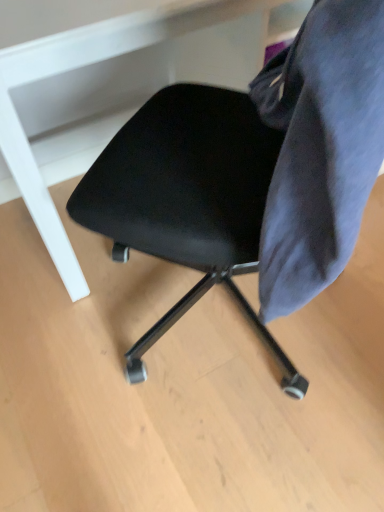
Question: Does black matte chair at center have a greater height compared to black leather chair at center?

Choices:
 (A) yes
 (B) no

Answer: (B)

Question: Is black matte chair at center outside of black leather chair at center?

Choices:
 (A) no
 (B) yes

Answer: (B)

Question: Is black matte chair at center surrounding black leather chair at center?

Choices:
 (A) no
 (B) yes

Answer: (A)

Question: Considering the relative sizes of black matte chair at center and black leather chair at center in the image provided, is black matte chair at center bigger than black leather chair at center?

Choices:
 (A) no
 (B) yes

Answer: (B)

Question: From the image's perspective, does black matte chair at center appear lower than black leather chair at center?

Choices:
 (A) no
 (B) yes

Answer: (A)

Question: Can you confirm if black matte chair at center is thinner than black leather chair at center?

Choices:
 (A) yes
 (B) no

Answer: (A)

Question: Does black matte chair at center have a greater height compared to velvet dark blue chair at right?

Choices:
 (A) yes
 (B) no

Answer: (A)

Question: From a real-world perspective, is black matte chair at center on top of velvet dark blue chair at right?

Choices:
 (A) no
 (B) yes

Answer: (A)

Question: Are black matte chair at center and velvet dark blue chair at right far apart?

Choices:
 (A) yes
 (B) no

Answer: (B)

Question: Does black matte chair at center have a greater width compared to velvet dark blue chair at right?

Choices:
 (A) no
 (B) yes

Answer: (B)

Question: Can you confirm if black matte chair at center is positioned to the right of velvet dark blue chair at right?

Choices:
 (A) yes
 (B) no

Answer: (B)

Question: Is velvet dark blue chair at right at the back of black matte chair at center?

Choices:
 (A) no
 (B) yes

Answer: (A)

Question: From a real-world perspective, is black leather chair at center under velvet dark blue chair at right?

Choices:
 (A) yes
 (B) no

Answer: (A)